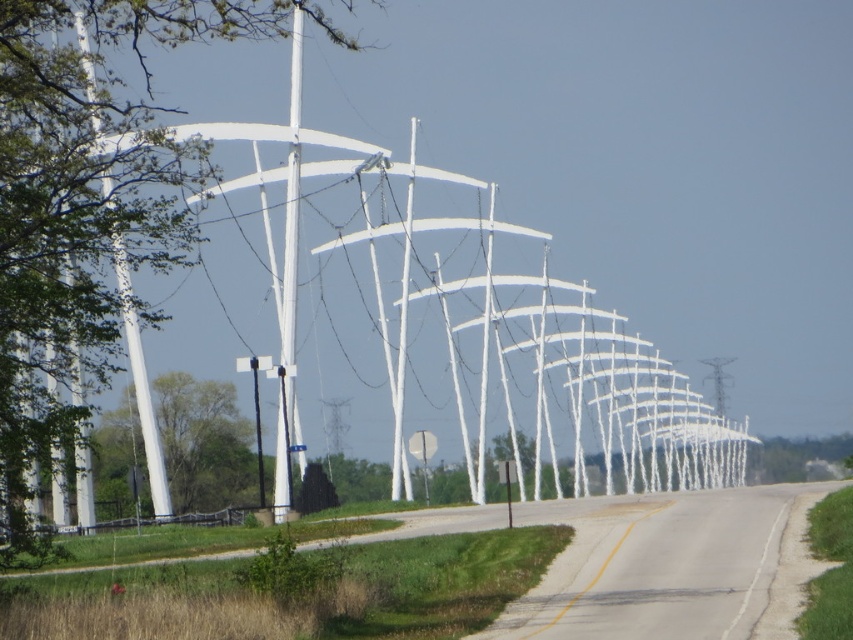
You are a cyclist approaching the yellow painted line at center on a rural road. There is a green leafy tree at left nearby. Which side of the road should you stay on to avoid the tree?

The green leafy tree at left is positioned on the left side of the yellow painted line at center. As a cyclist, you should stay on the right side of the yellow painted line at center to avoid the tree.

You are driving along the rural road and notice a green leafy tree at left and a white glossy pole at center. Which object would appear closer to you as you look ahead?

The green leafy tree at left appears closer because it is in front of the white glossy pole at center, meaning it is nearer to your viewpoint.